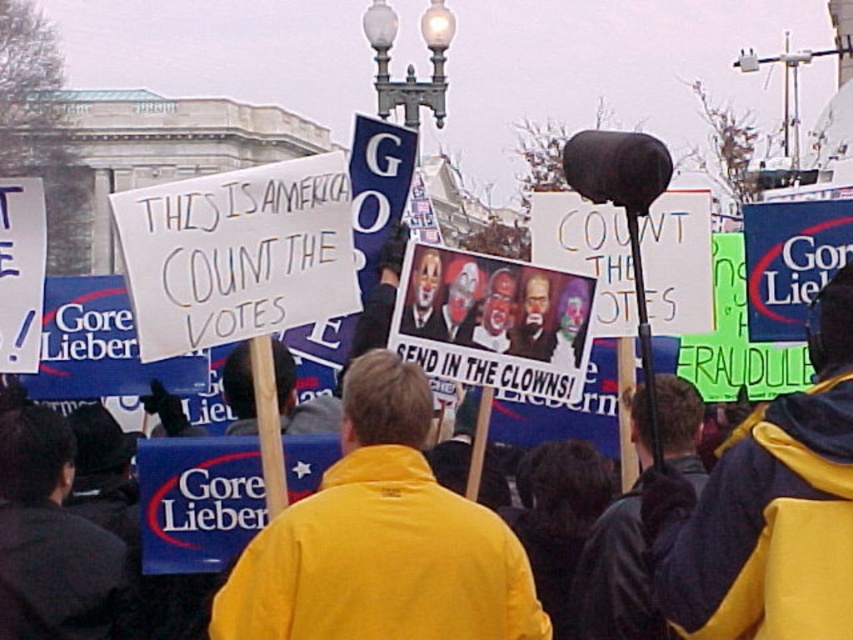
Consider the image. Is yellow fabric jacket at center to the left of yellow fabric jacket at lower right from the viewer's perspective?

Indeed, yellow fabric jacket at center is positioned on the left side of yellow fabric jacket at lower right.

Does yellow fabric jacket at center appear over yellow fabric jacket at lower right?

Actually, yellow fabric jacket at center is below yellow fabric jacket at lower right.

Does point (490, 536) lie in front of point (843, 276)?

Yes, it is.

This screenshot has height=640, width=853. Find the location of `yellow fabric jacket at center`. yellow fabric jacket at center is located at coordinates (381, 540).